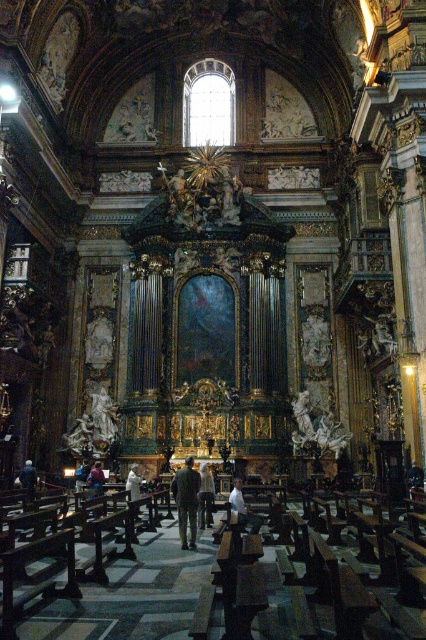
Does dark brown leather jacket at center have a greater height compared to light beige fabric coat at center?

Yes, dark brown leather jacket at center is taller than light beige fabric coat at center.

Can you confirm if dark brown leather jacket at center is positioned below light beige fabric coat at center?

No.

Which is behind, point (172, 483) or point (201, 461)?

The point (201, 461) is more distant.

Where is `dark brown leather jacket at center`? The height and width of the screenshot is (640, 426). dark brown leather jacket at center is located at coordinates (187, 500).

Does white matte shirt at center have a larger size compared to white clothed figure at center?

Incorrect, white matte shirt at center is not larger than white clothed figure at center.

Which is behind, point (241, 508) or point (129, 477)?

The point (129, 477) is more distant.

The image size is (426, 640). In order to click on white matte shirt at center in this screenshot , I will do `click(242, 508)`.

The height and width of the screenshot is (640, 426). Describe the element at coordinates (204, 497) in the screenshot. I see `light beige fabric coat at center` at that location.

Looking at this image, who is shorter, light beige fabric coat at center or white matte shirt at center?

With less height is white matte shirt at center.

What do you see at coordinates (204, 497) in the screenshot?
I see `light beige fabric coat at center` at bounding box center [204, 497].

Find the location of a particular element. This screenshot has height=640, width=426. light beige fabric coat at center is located at coordinates (204, 497).